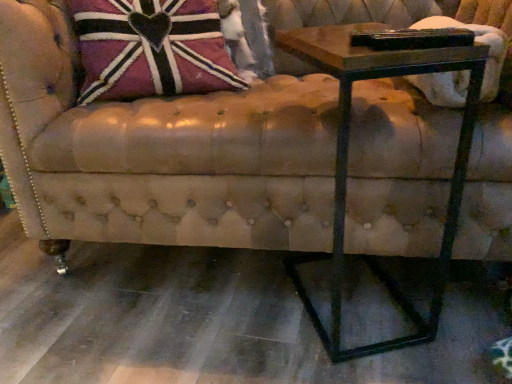
What are the coordinates of `free space in front of wooden table at right` in the screenshot? It's located at (x=380, y=364).